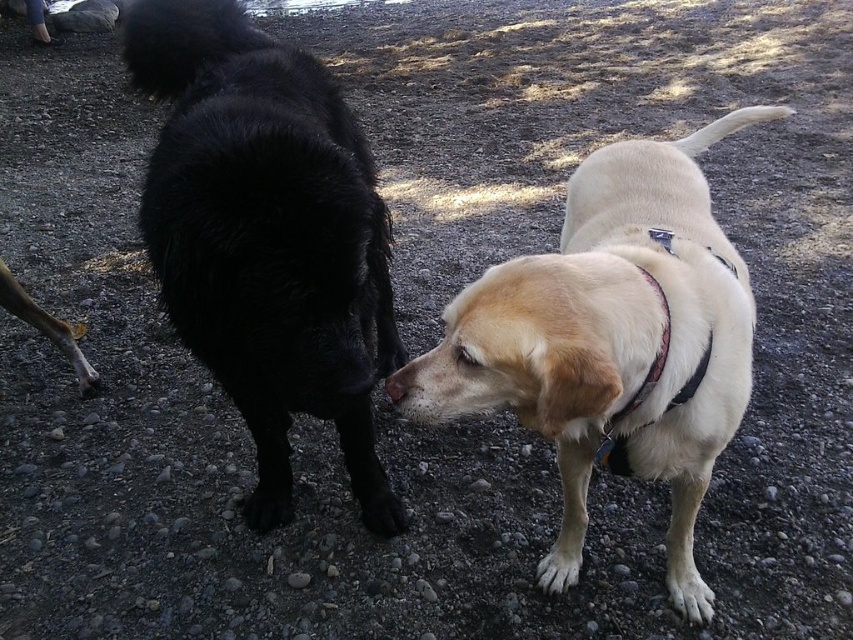
You are a dog owner who wants to put a collar on your dog. You have two options in the image, the multicolored fabric neckband at center and the brushed metal water at bottle left. Which one is shorter and thus more suitable for a smaller dog?

The multicolored fabric neckband at center is shorter than the brushed metal water at bottle left, making it more suitable for a smaller dog.

You are a dog trainer observing two dogs interacting. You notice a light beige fur at center and a multicolored fabric neckband at center. Which object is closer to you?

The light beige fur at center is closer to you because it is in front of the multicolored fabric neckband at center.